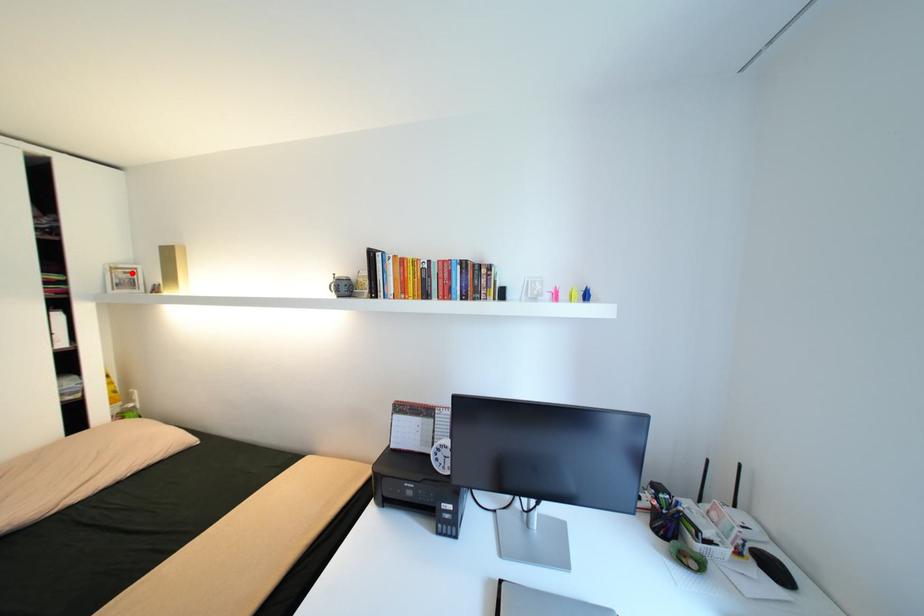
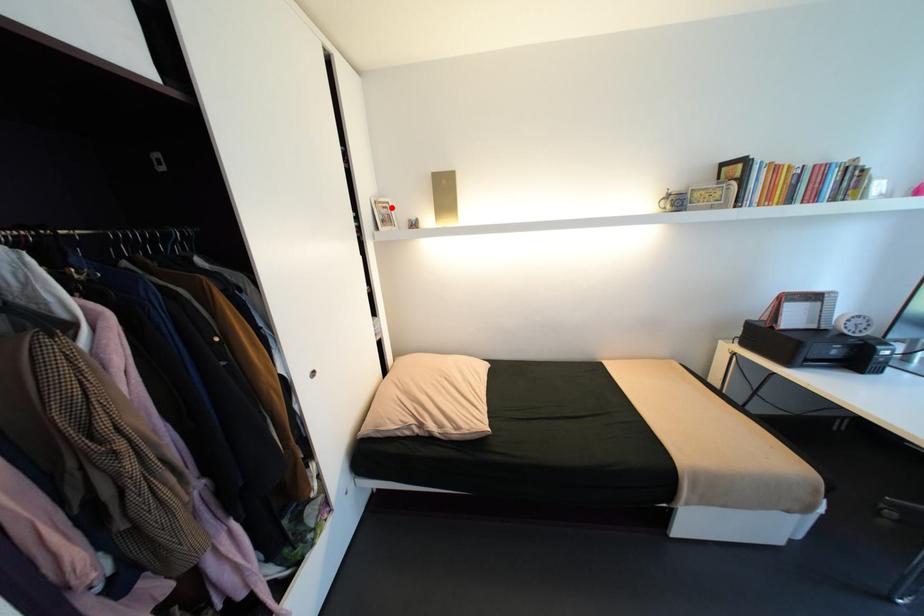
Consider the image. I am providing you with two images of the same scene from different viewpoints. A red point is marked on the first image and another point is marked on the second image. Is the red point in image1 aligned with the point shown in image2?

Yes